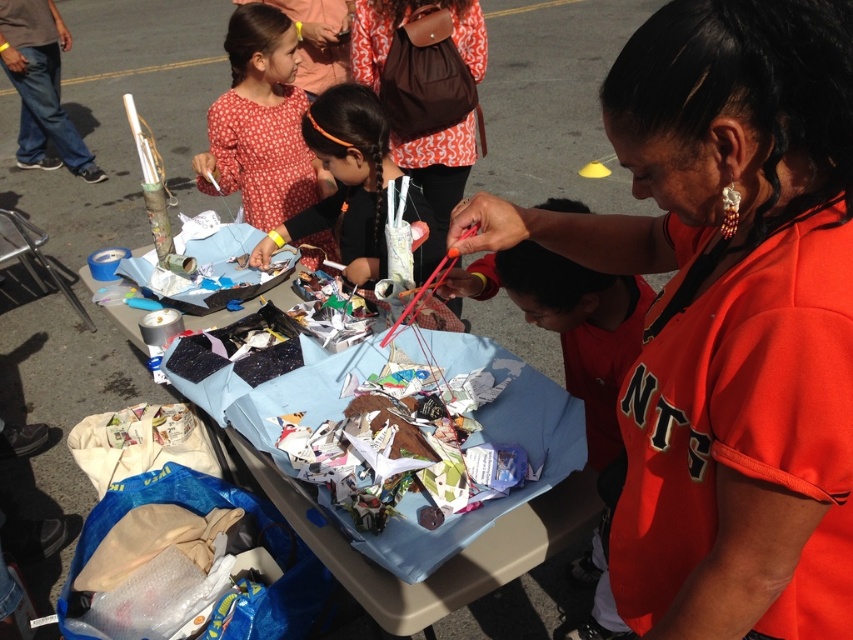
Between crinkled paper scraps at center and jeans at left, which one has more height?

jeans at left

Is the position of crinkled paper scraps at center more distant than that of jeans at left?

That is False.

Describe the element at coordinates (405, 436) in the screenshot. I see `crinkled paper scraps at center` at that location.

This screenshot has height=640, width=853. Find the location of `crinkled paper scraps at center`. crinkled paper scraps at center is located at coordinates (405, 436).

Can you confirm if blue fabric table at center is positioned above matte black hair at center?

Incorrect, blue fabric table at center is not positioned above matte black hair at center.

Is blue fabric table at center positioned before matte black hair at center?

No, blue fabric table at center is behind matte black hair at center.

Which is behind, point (424, 624) or point (347, 129)?

Point (347, 129)

The height and width of the screenshot is (640, 853). Identify the location of blue fabric table at center. (440, 564).

Is blue fabric table at center closer to camera compared to jeans at left?

Yes, it is.

In the scene shown: Is blue fabric table at center thinner than jeans at left?

Indeed, blue fabric table at center has a lesser width compared to jeans at left.

The image size is (853, 640). What are the coordinates of `blue fabric table at center` in the screenshot? It's located at (440, 564).